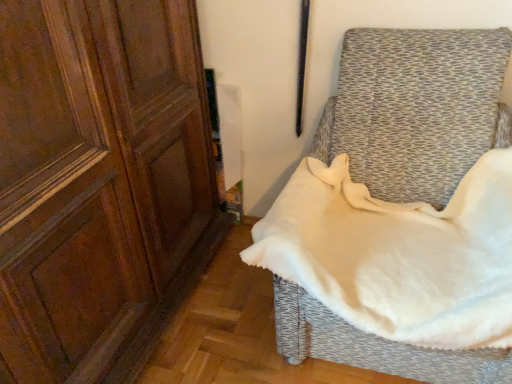
Question: Does white soft fabric at right have a greater width compared to matte wood screen door at left?

Choices:
 (A) yes
 (B) no

Answer: (A)

Question: Is white soft fabric at right bigger than matte wood screen door at left?

Choices:
 (A) no
 (B) yes

Answer: (A)

Question: Is white soft fabric at right looking in the opposite direction of matte wood screen door at left?

Choices:
 (A) no
 (B) yes

Answer: (A)

Question: Is white soft fabric at right outside matte wood screen door at left?

Choices:
 (A) no
 (B) yes

Answer: (B)

Question: Can you confirm if white soft fabric at right is smaller than matte wood screen door at left?

Choices:
 (A) no
 (B) yes

Answer: (B)

Question: Can you confirm if white soft fabric at right is positioned to the left of matte wood screen door at left?

Choices:
 (A) no
 (B) yes

Answer: (A)

Question: Is white soft fabric at right located within matte wood screen door at left?

Choices:
 (A) yes
 (B) no

Answer: (B)

Question: From a real-world perspective, is matte wood screen door at left beneath white soft fabric at right?

Choices:
 (A) no
 (B) yes

Answer: (A)

Question: Is matte wood screen door at left oriented away from white soft fabric at right?

Choices:
 (A) no
 (B) yes

Answer: (A)

Question: Would you say matte wood screen door at left is a long distance from white soft fabric at right?

Choices:
 (A) yes
 (B) no

Answer: (B)

Question: From the image's perspective, is matte wood screen door at left located above white soft fabric at right?

Choices:
 (A) yes
 (B) no

Answer: (A)

Question: Is matte wood screen door at left facing towards white soft fabric at right?

Choices:
 (A) yes
 (B) no

Answer: (A)

Question: Is point (134, 249) closer or farther from the camera than point (443, 170)?

Choices:
 (A) farther
 (B) closer

Answer: (B)